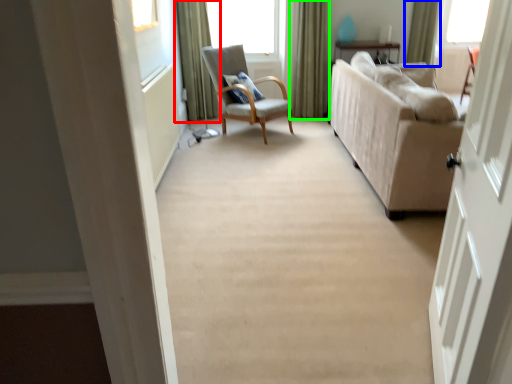
Question: Based on their relative distances, which object is nearer to curtain (highlighted by a red box)? Choose from curtain (highlighted by a blue box) and curtain (highlighted by a green box).

Choices:
 (A) curtain
 (B) curtain

Answer: (B)